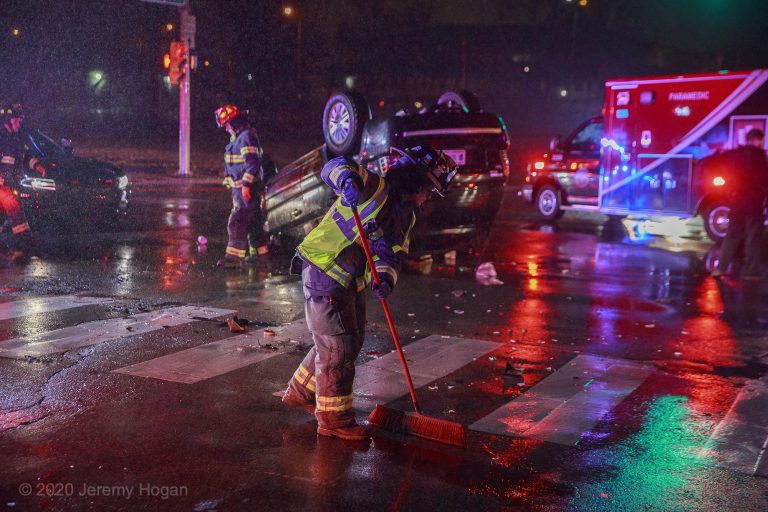
This screenshot has width=768, height=512. What are the coordinates of `broom` in the screenshot? It's located at (425, 420).